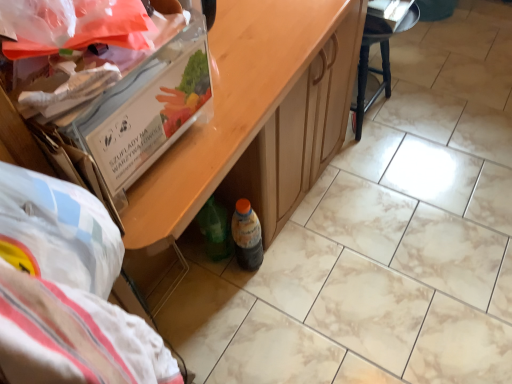
Question: Is wooden table at center outside of black wood stool at upper right?

Choices:
 (A) no
 (B) yes

Answer: (B)

Question: Does wooden table at center have a greater height compared to black wood stool at upper right?

Choices:
 (A) no
 (B) yes

Answer: (B)

Question: Is wooden table at center further to the viewer compared to black wood stool at upper right?

Choices:
 (A) yes
 (B) no

Answer: (B)

Question: Considering the relative sizes of wooden table at center and black wood stool at upper right in the image provided, is wooden table at center smaller than black wood stool at upper right?

Choices:
 (A) yes
 (B) no

Answer: (B)

Question: Is wooden table at center to the right of black wood stool at upper right from the viewer's perspective?

Choices:
 (A) yes
 (B) no

Answer: (B)

Question: Considering the relative sizes of wooden table at center and black wood stool at upper right in the image provided, is wooden table at center wider than black wood stool at upper right?

Choices:
 (A) no
 (B) yes

Answer: (B)

Question: Are black wood stool at upper right and translucent plastic bottle at lower center far apart?

Choices:
 (A) no
 (B) yes

Answer: (A)

Question: Can you confirm if black wood stool at upper right is taller than translucent plastic bottle at lower center?

Choices:
 (A) no
 (B) yes

Answer: (B)

Question: From a real-world perspective, does black wood stool at upper right sit lower than translucent plastic bottle at lower center?

Choices:
 (A) yes
 (B) no

Answer: (B)

Question: From a real-world perspective, is black wood stool at upper right on top of translucent plastic bottle at lower center?

Choices:
 (A) no
 (B) yes

Answer: (B)

Question: From the image's perspective, is black wood stool at upper right on top of translucent plastic bottle at lower center?

Choices:
 (A) yes
 (B) no

Answer: (A)

Question: Are black wood stool at upper right and translucent plastic bottle at lower center beside each other?

Choices:
 (A) yes
 (B) no

Answer: (B)

Question: Considering the relative positions of translucent plastic bottle at lower center and black wood stool at upper right in the image provided, is translucent plastic bottle at lower center behind black wood stool at upper right?

Choices:
 (A) yes
 (B) no

Answer: (B)